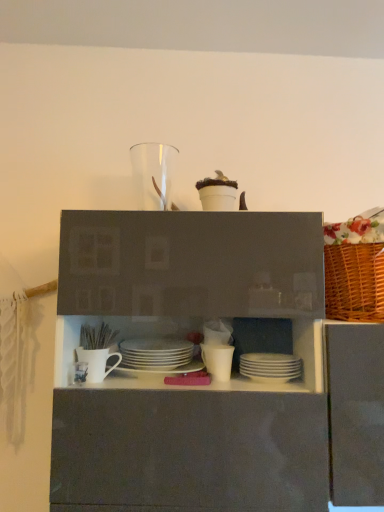
Question: Is white glossy plates at center, marked as the fourth tableware in a bottom-to-top arrangement, facing towards white matte mug at center, positioned as the fifth tableware in bottom-to-top order?

Choices:
 (A) yes
 (B) no

Answer: (B)

Question: From a real-world perspective, is white glossy plates at center, which is the fourth tableware from left to right, located beneath white matte mug at center, positioned as the fifth tableware in bottom-to-top order?

Choices:
 (A) no
 (B) yes

Answer: (A)

Question: Is white glossy plates at center, arranged as the 3th tableware when viewed from the top, turned away from white matte mug at center, placed as the second tableware when sorted from left to right?

Choices:
 (A) yes
 (B) no

Answer: (B)

Question: Is white glossy plates at center, arranged as the 3th tableware when viewed from the top, bigger than white matte mug at center, which is the second tableware from top to bottom?

Choices:
 (A) no
 (B) yes

Answer: (B)

Question: Considering the relative sizes of white glossy plates at center, which is the fourth tableware from left to right, and white matte mug at center, the 5th tableware from the right, in the image provided, is white glossy plates at center, which is the fourth tableware from left to right, shorter than white matte mug at center, the 5th tableware from the right,?

Choices:
 (A) no
 (B) yes

Answer: (B)

Question: Is white glossy plates at center, the 3th tableware from the right, bigger or smaller than white matte mug at center, acting as the 4th tableware starting from the top?

Choices:
 (A) small
 (B) big

Answer: (B)

Question: Does point (129, 352) appear closer or farther from the camera than point (77, 360)?

Choices:
 (A) farther
 (B) closer

Answer: (A)

Question: In terms of height, does white glossy plates at center, the 3th tableware from the right, look taller or shorter compared to white matte mug at center, acting as the 4th tableware starting from the top?

Choices:
 (A) short
 (B) tall

Answer: (B)

Question: Visually, is white glossy plates at center, which is the fourth tableware from left to right, positioned to the left or to the right of white matte mug at center, acting as the 4th tableware starting from the top?

Choices:
 (A) right
 (B) left

Answer: (A)

Question: In terms of height, does white matte mug at center, positioned as the fifth tableware in bottom-to-top order, look taller or shorter compared to white matte cup at center, the second tableware from the right?

Choices:
 (A) tall
 (B) short

Answer: (B)

Question: Is white matte mug at center, placed as the second tableware when sorted from left to right, inside the boundaries of white matte cup at center, the fifth tableware positioned from the left, or outside?

Choices:
 (A) inside
 (B) outside

Answer: (B)

Question: Considering the relative positions of white matte mug at center, placed as the second tableware when sorted from left to right, and white matte cup at center, which is the fifth tableware in top-to-bottom order, in the image provided, is white matte mug at center, placed as the second tableware when sorted from left to right, to the left or to the right of white matte cup at center, which is the fifth tableware in top-to-bottom order,?

Choices:
 (A) left
 (B) right

Answer: (A)

Question: From a real-world perspective, relative to white matte cup at center, the second tableware from the right, is white matte mug at center, the 5th tableware from the right, vertically above or below?

Choices:
 (A) above
 (B) below

Answer: (A)

Question: From a real-world perspective, is transparent glass vase at upper center, positioned as the first tableware in top-to-bottom order, positioned above or below white matte cup at center, the fifth tableware positioned from the left?

Choices:
 (A) above
 (B) below

Answer: (A)

Question: Would you say transparent glass vase at upper center, which is counted as the 6th tableware, starting from the bottom, is to the left or to the right of white matte cup at center, which is the fifth tableware in top-to-bottom order, in the picture?

Choices:
 (A) left
 (B) right

Answer: (A)